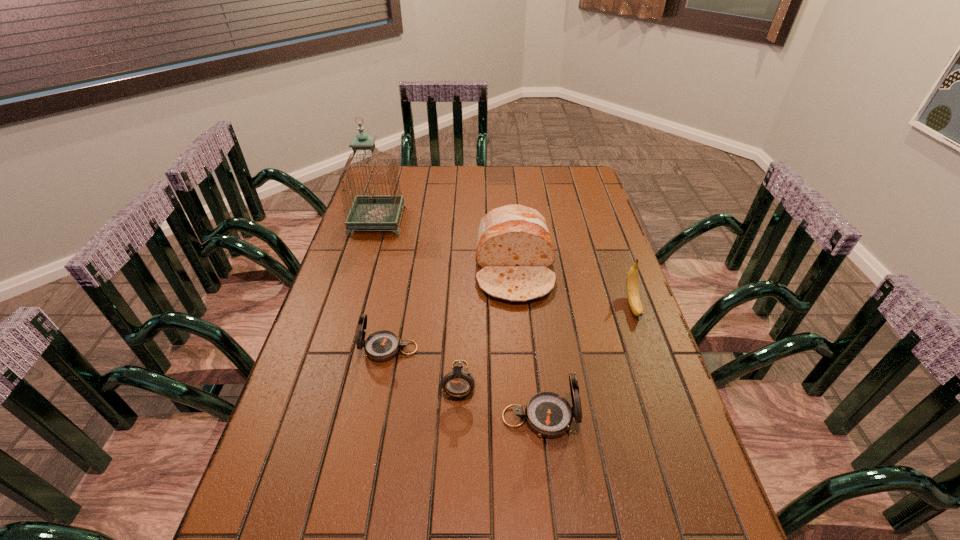
In the image, there is a desktop. Identify the location of vacant area at the near edge. (466, 510).

Identify the location of free space at the left edge of the desktop. (292, 433).

At what (x,y) coordinates should I click in order to perform the action: click on vacant area at the right edge of the desktop. Please return your answer as a coordinate pair (x, y). The width and height of the screenshot is (960, 540). Looking at the image, I should click on (592, 254).

Where is `vacant space at the far left corner`? This screenshot has width=960, height=540. vacant space at the far left corner is located at coordinates (377, 188).

At what (x,y) coordinates should I click in order to perform the action: click on unoccupied area between the tallest object and the second compass from right to left. Please return your answer as a coordinate pair (x, y). Looking at the image, I should click on (419, 301).

You are a GUI agent. You are given a task and a screenshot of the screen. Output one action in this format:
    pyautogui.click(x=<x>, y=<y>)
    Task: Click on the vacant area that lies between the leftmost compass and the shortest compass
    The width and height of the screenshot is (960, 540).
    Given the screenshot: What is the action you would take?
    pyautogui.click(x=424, y=364)

Locate an element on the screen. This screenshot has height=540, width=960. free spot between the rightmost compass and the farthest object is located at coordinates (459, 319).

Where is `free space that is in between the rightmost compass and the banana`? This screenshot has height=540, width=960. free space that is in between the rightmost compass and the banana is located at coordinates (587, 361).

The height and width of the screenshot is (540, 960). I want to click on free spot between the bread and the shortest compass, so click(487, 325).

The height and width of the screenshot is (540, 960). Identify the location of free space between the rightmost compass and the second compass from right to left. (499, 399).